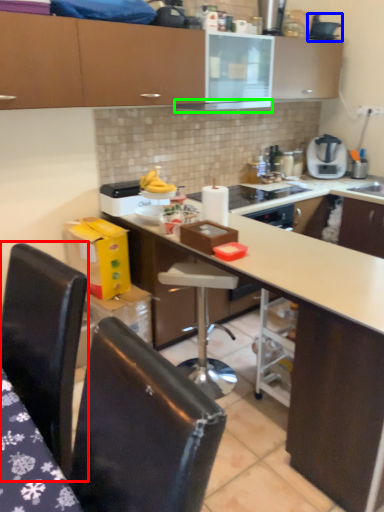
Question: Estimate the real-world distances between objects in this image. Which object is closer to chair (highlighted by a red box), appliance (highlighted by a blue box) or exhaust hood (highlighted by a green box)?

Choices:
 (A) appliance
 (B) exhaust hood

Answer: (B)